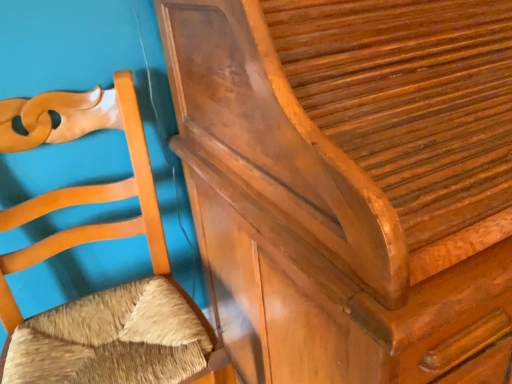
Question: From a real-world perspective, does matte wood chair at left, placed as the first furniture when sorted from left to right, stand above shiny brown wood dresser at upper right, which is the 2th furniture in left-to-right order?

Choices:
 (A) yes
 (B) no

Answer: (B)

Question: Does matte wood chair at left, placed as the first furniture when sorted from left to right, appear on the right side of shiny brown wood dresser at upper right, which is the 2th furniture in left-to-right order?

Choices:
 (A) yes
 (B) no

Answer: (B)

Question: Is matte wood chair at left, placed as the first furniture when sorted from left to right, bigger than shiny brown wood dresser at upper right, which is counted as the 1th furniture, starting from the right?

Choices:
 (A) yes
 (B) no

Answer: (B)

Question: Is the position of matte wood chair at left, the 2th furniture positioned from the right, more distant than that of shiny brown wood dresser at upper right, which is counted as the 1th furniture, starting from the right?

Choices:
 (A) no
 (B) yes

Answer: (B)

Question: Is matte wood chair at left, placed as the first furniture when sorted from left to right, taller than shiny brown wood dresser at upper right, which is counted as the 1th furniture, starting from the right?

Choices:
 (A) no
 (B) yes

Answer: (A)

Question: Considering the relative sizes of matte wood chair at left, placed as the first furniture when sorted from left to right, and shiny brown wood dresser at upper right, which is the 2th furniture in left-to-right order, in the image provided, is matte wood chair at left, placed as the first furniture when sorted from left to right, shorter than shiny brown wood dresser at upper right, which is the 2th furniture in left-to-right order,?

Choices:
 (A) no
 (B) yes

Answer: (B)

Question: Can you confirm if shiny brown wood dresser at upper right, which is the 2th furniture in left-to-right order, is shorter than matte wood chair at left, the 2th furniture positioned from the right?

Choices:
 (A) no
 (B) yes

Answer: (A)

Question: Is shiny brown wood dresser at upper right, which is the 2th furniture in left-to-right order, facing towards matte wood chair at left, the 2th furniture positioned from the right?

Choices:
 (A) yes
 (B) no

Answer: (B)

Question: From a real-world perspective, is shiny brown wood dresser at upper right, which is the 2th furniture in left-to-right order, located beneath matte wood chair at left, the 2th furniture positioned from the right?

Choices:
 (A) no
 (B) yes

Answer: (A)

Question: Is shiny brown wood dresser at upper right, which is counted as the 1th furniture, starting from the right, facing away from matte wood chair at left, placed as the first furniture when sorted from left to right?

Choices:
 (A) yes
 (B) no

Answer: (B)

Question: Does shiny brown wood dresser at upper right, which is the 2th furniture in left-to-right order, appear on the right side of matte wood chair at left, the 2th furniture positioned from the right?

Choices:
 (A) yes
 (B) no

Answer: (A)

Question: Is shiny brown wood dresser at upper right, which is the 2th furniture in left-to-right order, further to camera compared to matte wood chair at left, placed as the first furniture when sorted from left to right?

Choices:
 (A) yes
 (B) no

Answer: (B)

Question: Looking at their shapes, would you say matte wood chair at left, placed as the first furniture when sorted from left to right, is wider or thinner than shiny brown wood dresser at upper right, which is the 2th furniture in left-to-right order?

Choices:
 (A) wide
 (B) thin

Answer: (B)